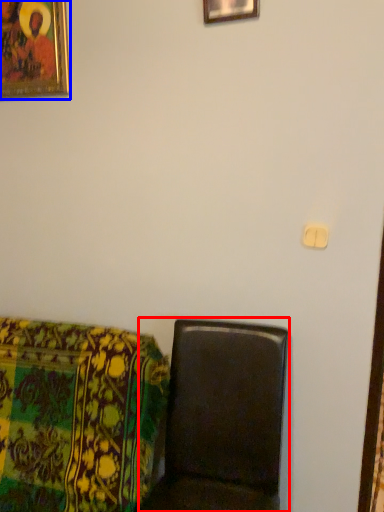
Question: Which point is further to the camera, furniture (highlighted by a red box) or picture frame (highlighted by a blue box)?

Choices:
 (A) furniture
 (B) picture frame

Answer: (B)